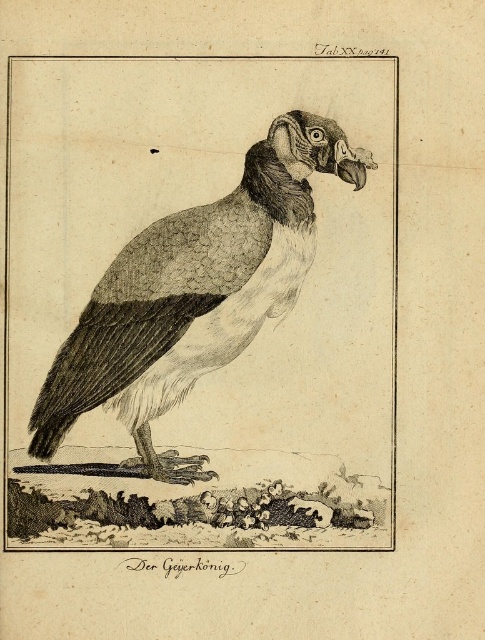
From the picture: Does gray textured vulture at center have a smaller size compared to matte black beak at upper center?

Actually, gray textured vulture at center might be larger than matte black beak at upper center.

This screenshot has width=485, height=640. Identify the location of gray textured vulture at center. (191, 292).